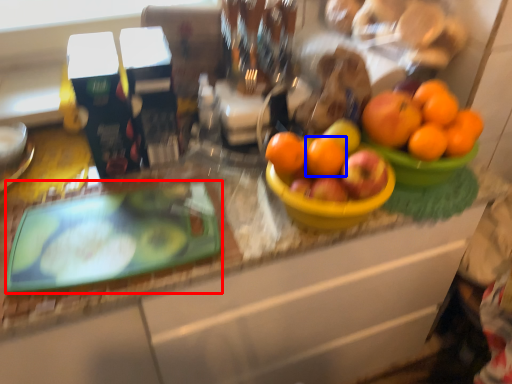
Question: Which object appears closest to the camera in this image, glass plate (highlighted by a red box) or orange (highlighted by a blue box)?

Choices:
 (A) glass plate
 (B) orange

Answer: (A)